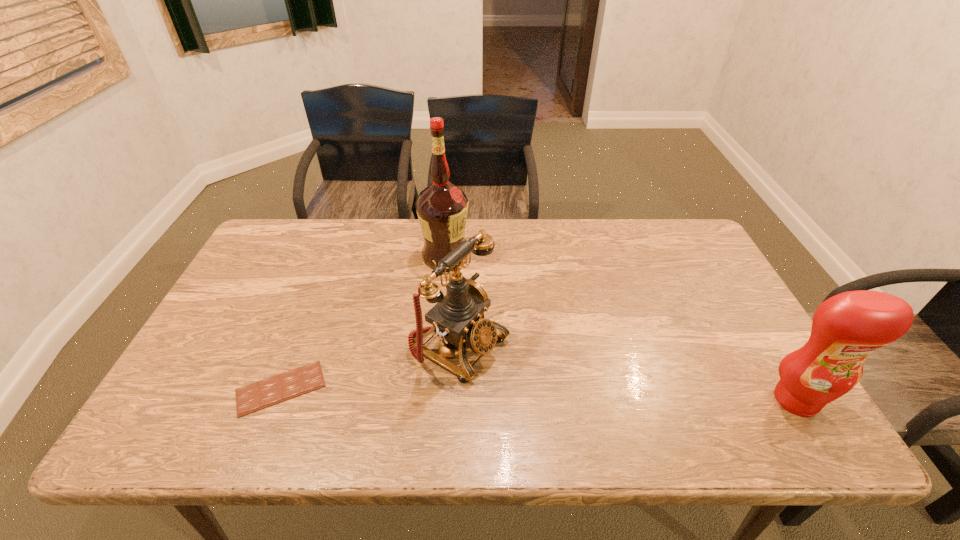
Image resolution: width=960 pixels, height=540 pixels. In order to click on chocolate bar in this screenshot , I will do `click(253, 397)`.

Identify the location of the shortest object. The width and height of the screenshot is (960, 540). (253, 397).

Where is `condiment`? This screenshot has height=540, width=960. condiment is located at coordinates (846, 328).

Where is `the tallest object`? This screenshot has width=960, height=540. the tallest object is located at coordinates (442, 208).

Identify the location of the farthest object. (442, 208).

Find the location of a particular element. telephone is located at coordinates (458, 317).

You are a GUI agent. You are given a task and a screenshot of the screen. Output one action in this format:
    pyautogui.click(x=<x>, y=<y>)
    Task: Click on the vacant area situated 0.090m on the right of the leftmost object
    
    Given the screenshot: What is the action you would take?
    pyautogui.click(x=364, y=388)

I want to click on free space located on the label of the farthest object, so click(510, 329).

At what (x,y) coordinates should I click in order to perform the action: click on free location located on the label of the farthest object. Please return your answer as a coordinate pair (x, y). Looking at the image, I should click on (505, 324).

Find the location of `vacant space located 0.150m on the label of the farthest object`. vacant space located 0.150m on the label of the farthest object is located at coordinates (484, 300).